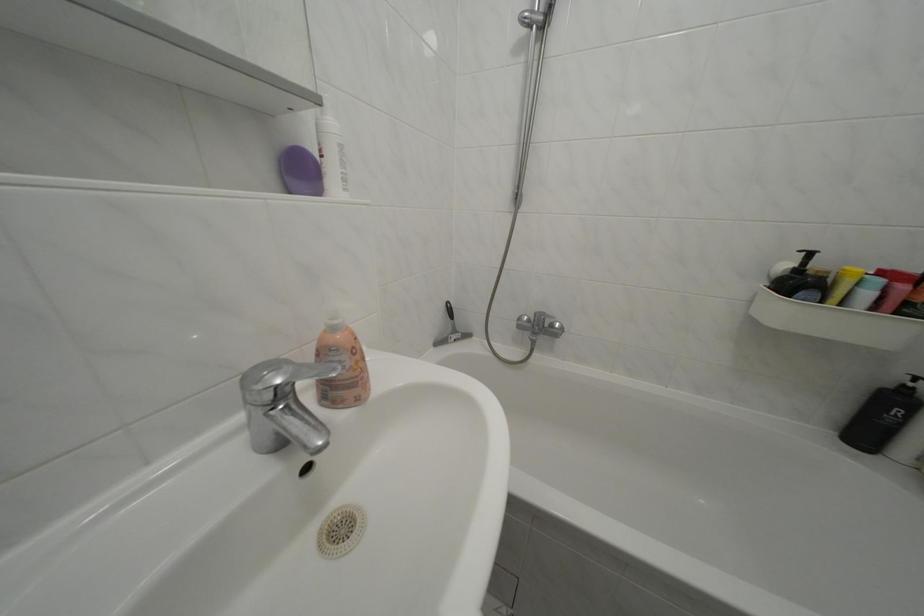
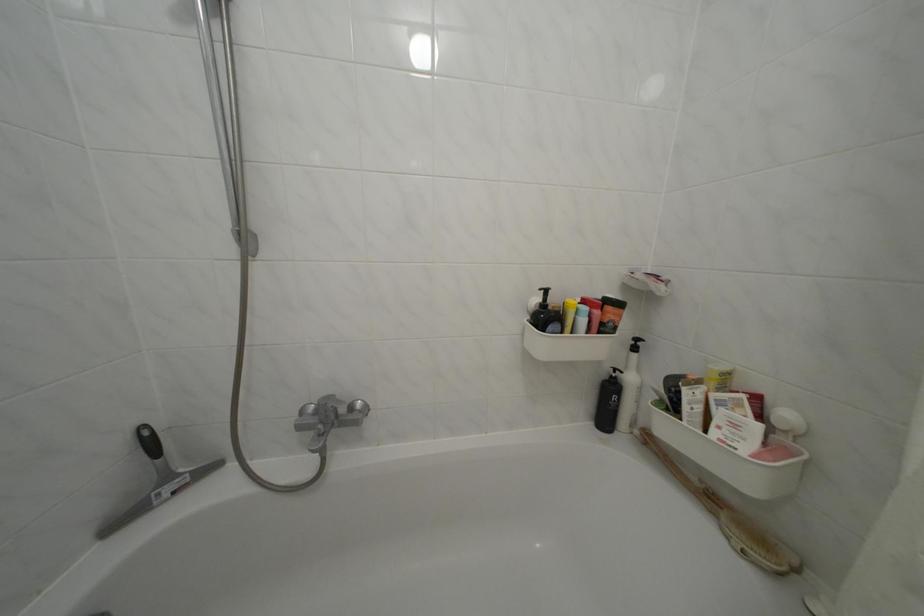
Find the pixel in the second image that matches pixel 464 338 in the first image.

(176, 484)